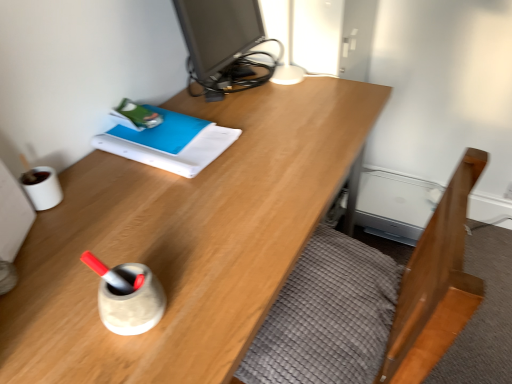
Locate an element on the screen. The height and width of the screenshot is (384, 512). matte black monitor at upper center is located at coordinates [218, 32].

Locate an element on the screen. This screenshot has height=384, width=512. matte black monitor at upper center is located at coordinates (218, 32).

Who is more distant, wooden bed frame at lower right or matte black monitor at upper center?

matte black monitor at upper center is further from the camera.

Is matte black monitor at upper center completely or partially inside wooden bed frame at lower right?

No, matte black monitor at upper center is not surrounded by wooden bed frame at lower right.

Where is `bed frame that is on the right side of matte black monitor at upper center`? The image size is (512, 384). bed frame that is on the right side of matte black monitor at upper center is located at coordinates (372, 303).

Is point (349, 272) in front of point (220, 23)?

That is True.

In the scene shown: Would you say wooden bed frame at lower right is outside wooden desk at center?

No, wooden bed frame at lower right is not entirely external to wooden desk at center.

From the image's perspective, which is above, wooden bed frame at lower right or wooden desk at center?

From the image's view, wooden desk at center is above.

How distant is wooden bed frame at lower right from wooden desk at center?

A distance of 10.78 inches exists between wooden bed frame at lower right and wooden desk at center.

From the image's perspective, is matte black monitor at upper center located above or below wooden bed frame at lower right?

Based on their image positions, matte black monitor at upper center is located above wooden bed frame at lower right.

Between matte black monitor at upper center and wooden bed frame at lower right, which one is positioned in front?

Positioned in front is wooden bed frame at lower right.

Based on their sizes in the image, would you say matte black monitor at upper center is bigger or smaller than wooden bed frame at lower right?

matte black monitor at upper center is bigger than wooden bed frame at lower right.

Is matte black monitor at upper center inside the boundaries of wooden bed frame at lower right, or outside?

matte black monitor at upper center is located beyond the bounds of wooden bed frame at lower right.

From the image's perspective, is wooden desk at center over matte black monitor at upper center?

No.

Is wooden desk at center oriented towards matte black monitor at upper center?

No.

Is wooden desk at center directly adjacent to matte black monitor at upper center?

No.

Does wooden desk at center lie behind matte black monitor at upper center?

No, the depth of wooden desk at center is less than that of matte black monitor at upper center.

How distant is matte black monitor at upper center from wooden desk at center?

A distance of 14.64 inches exists between matte black monitor at upper center and wooden desk at center.

Can you confirm if matte black monitor at upper center is shorter than wooden desk at center?

Correct, matte black monitor at upper center is not as tall as wooden desk at center.

Who is smaller, matte black monitor at upper center or wooden desk at center?

Smaller between the two is matte black monitor at upper center.

From a real-world perspective, which object stands above the other?

matte black monitor at upper center.

Based on the photo, between blue matte book at upper left and matte black monitor at upper center, which one has larger size?

With larger size is matte black monitor at upper center.

Is the depth of blue matte book at upper left less than that of matte black monitor at upper center?

Yes, it is in front of matte black monitor at upper center.

Image resolution: width=512 pixels, height=384 pixels. Identify the location of book in front of the matte black monitor at upper center. (170, 142).

Is wooden desk at center directly adjacent to blue matte book at upper left?

No, wooden desk at center is not next to blue matte book at upper left.

Find the location of a particular element. desk below the blue matte book at upper left (from a real-world perspective) is located at coordinates (185, 240).

Is wooden desk at center facing away from blue matte book at upper left?

No.

Which is more to the right, wooden desk at center or blue matte book at upper left?

wooden desk at center.

Identify the location of bed frame that appears below the matte black monitor at upper center (from a real-world perspective). (372, 303).

Locate an element on the screen. bed frame lying on the right of wooden desk at center is located at coordinates (372, 303).

Considering their positions, is blue matte book at upper left positioned further to wooden desk at center than wooden bed frame at lower right?

wooden bed frame at lower right is positioned further to the anchor wooden desk at center.

Considering their positions, is wooden desk at center positioned further to matte black monitor at upper center than blue matte book at upper left?

wooden desk at center.

Which object lies further to the anchor point blue matte book at upper left, wooden desk at center or wooden bed frame at lower right?

wooden bed frame at lower right lies further to blue matte book at upper left than the other object.

Which object lies further to the anchor point blue matte book at upper left, wooden bed frame at lower right or matte black monitor at upper center?

wooden bed frame at lower right.

Based on their spatial positions, is wooden bed frame at lower right or wooden desk at center further from blue matte book at upper left?

wooden bed frame at lower right lies further to blue matte book at upper left than the other object.

Which object lies further to the anchor point wooden bed frame at lower right, matte black monitor at upper center or wooden desk at center?

The object further to wooden bed frame at lower right is matte black monitor at upper center.

Based on their spatial positions, is blue matte book at upper left or wooden desk at center closer to wooden bed frame at lower right?

The object closer to wooden bed frame at lower right is wooden desk at center.

Looking at the image, which one is located further to wooden desk at center, blue matte book at upper left or matte black monitor at upper center?

matte black monitor at upper center is positioned further to the anchor wooden desk at center.

Identify the location of desk between matte black monitor at upper center and wooden bed frame at lower right from top to bottom. The width and height of the screenshot is (512, 384). (185, 240).

At what (x,y) coordinates should I click in order to perform the action: click on book between matte black monitor at upper center and wooden bed frame at lower right vertically. Please return your answer as a coordinate pair (x, y). The image size is (512, 384). Looking at the image, I should click on (170, 142).

Identify the location of book between matte black monitor at upper center and wooden desk at center from top to bottom. The height and width of the screenshot is (384, 512). (170, 142).

Locate an element on the screen. This screenshot has height=384, width=512. bed frame positioned between wooden desk at center and blue matte book at upper left from near to far is located at coordinates (372, 303).